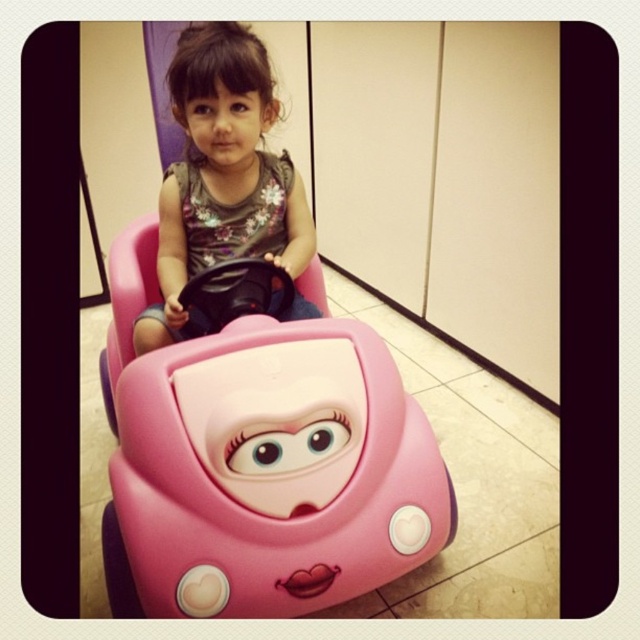
Question: Is pink plastic toy car at center positioned before matte pink toy car at center?

Choices:
 (A) yes
 (B) no

Answer: (A)

Question: Is pink plastic toy car at center behind matte pink toy car at center?

Choices:
 (A) yes
 (B) no

Answer: (B)

Question: Does pink plastic toy car at center appear on the left side of matte pink toy car at center?

Choices:
 (A) no
 (B) yes

Answer: (A)

Question: Which point is farther from the camera taking this photo?

Choices:
 (A) (317, 468)
 (B) (266, 90)

Answer: (B)

Question: Which point is farther from the camera taking this photo?

Choices:
 (A) (292, 317)
 (B) (104, 358)

Answer: (B)